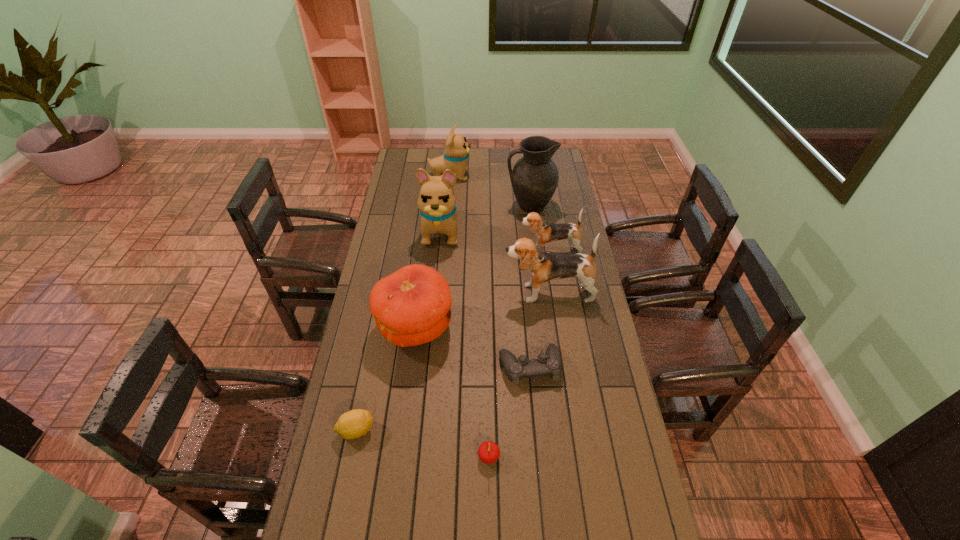
This screenshot has width=960, height=540. In order to click on the nearer beige puppy in this screenshot , I will do `click(436, 202)`.

At what (x,y) coordinates should I click in order to perform the action: click on pitcher. Please return your answer as a coordinate pair (x, y). Looking at the image, I should click on (534, 178).

At what (x,y) coordinates should I click in order to perform the action: click on the bigger brown puppy. Please return your answer as a coordinate pair (x, y). Looking at the image, I should click on (543, 266).

Locate an element on the screen. the nearest puppy is located at coordinates (543, 266).

The height and width of the screenshot is (540, 960). In order to click on the farthest puppy in this screenshot , I will do `click(457, 150)`.

You are a GUI agent. You are given a task and a screenshot of the screen. Output one action in this format:
    pyautogui.click(x=<x>, y=<y>)
    Task: Click on the farthest object
    The width and height of the screenshot is (960, 540).
    Given the screenshot: What is the action you would take?
    pyautogui.click(x=457, y=150)

This screenshot has width=960, height=540. I want to click on pumpkin, so click(411, 306).

Where is `the farther brown puppy`? The height and width of the screenshot is (540, 960). the farther brown puppy is located at coordinates (545, 231).

I want to click on the shortest puppy, so click(545, 231).

Where is `red cherry`? red cherry is located at coordinates (488, 452).